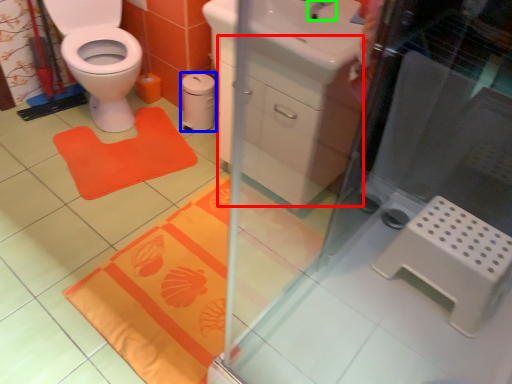
Question: Based on their relative distances, which object is nearer to drawer (highlighted by a red box)? Choose from toilet paper (highlighted by a blue box) and tap (highlighted by a green box).

Choices:
 (A) toilet paper
 (B) tap

Answer: (B)